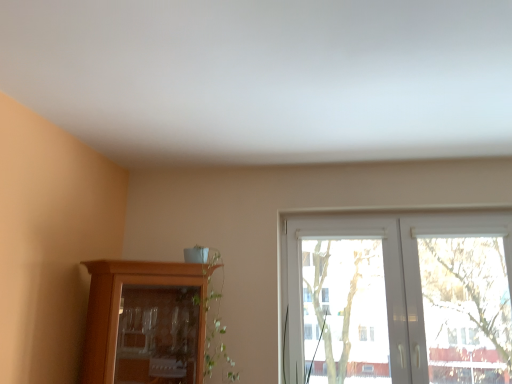
Question: Is point (134, 339) positioned closer to the camera than point (348, 278)?

Choices:
 (A) closer
 (B) farther

Answer: (A)

Question: Is wooden cabinet at lower left inside the boundaries of white plastic window at center, or outside?

Choices:
 (A) outside
 (B) inside

Answer: (A)

Question: From a real-world perspective, relative to white plastic window at center, is wooden cabinet at lower left vertically above or below?

Choices:
 (A) below
 (B) above

Answer: (A)

Question: From a real-world perspective, is white plastic window at center physically located above or below wooden cabinet at lower left?

Choices:
 (A) above
 (B) below

Answer: (A)

Question: From the image's perspective, is white plastic window at center above or below wooden cabinet at lower left?

Choices:
 (A) below
 (B) above

Answer: (B)

Question: Considering the positions of white plastic window at center and wooden cabinet at lower left in the image, is white plastic window at center taller or shorter than wooden cabinet at lower left?

Choices:
 (A) short
 (B) tall

Answer: (B)

Question: Is white plastic window at center inside the boundaries of wooden cabinet at lower left, or outside?

Choices:
 (A) inside
 (B) outside

Answer: (B)